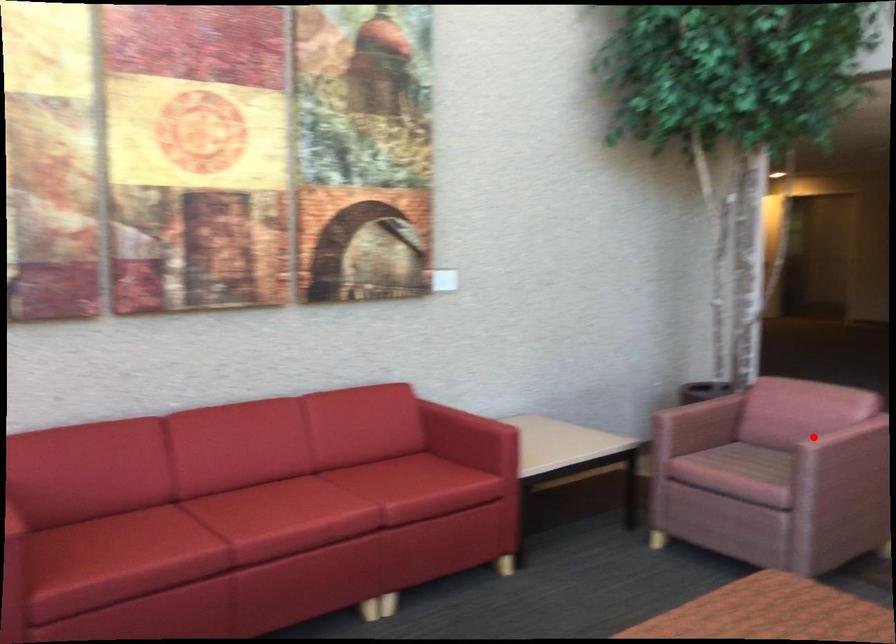
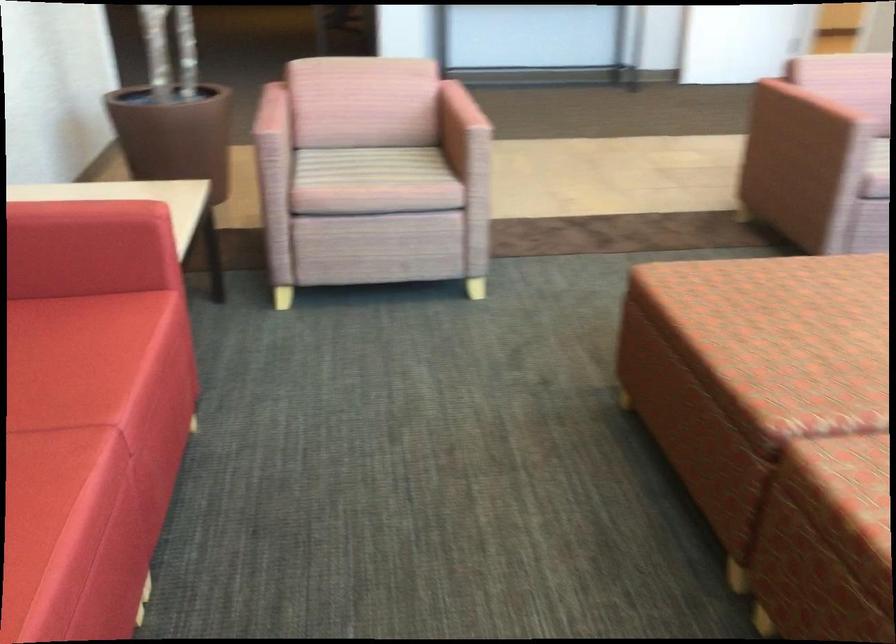
The point at the highlighted location is marked in the first image. Where is the corresponding point in the second image?

(459, 118)